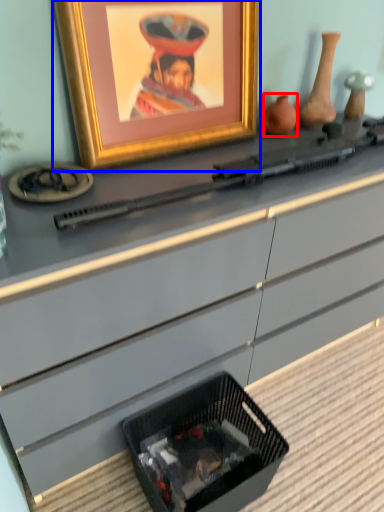
Question: Which of the following is the closest to the observer, vase (highlighted by a red box) or picture frame (highlighted by a blue box)?

Choices:
 (A) vase
 (B) picture frame

Answer: (B)